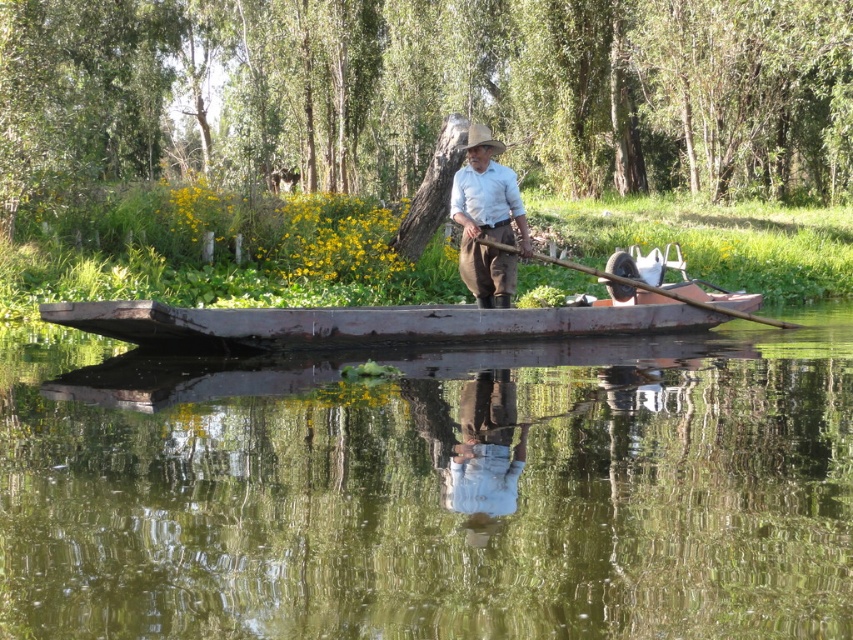
Question: Among these points, which one is farthest from the camera?

Choices:
 (A) (186, 339)
 (B) (819, 518)
 (C) (694, 300)

Answer: (C)

Question: Which point is farther from the camera taking this photo?

Choices:
 (A) (466, 182)
 (B) (227, 538)
 (C) (624, 262)
 (D) (775, 324)

Answer: (D)

Question: Does rusty wood boat at center lie behind light brown cotton shirt at center?

Choices:
 (A) no
 (B) yes

Answer: (B)

Question: Which point is closer to the camera taking this photo?

Choices:
 (A) click(54, 404)
 (B) click(490, 310)
 (C) click(792, 324)

Answer: (A)

Question: Is light brown cotton shirt at center smaller than wooden at center?

Choices:
 (A) yes
 (B) no

Answer: (B)

Question: Can you confirm if rusty wood boat at center is thinner than wooden at center?

Choices:
 (A) yes
 (B) no

Answer: (B)